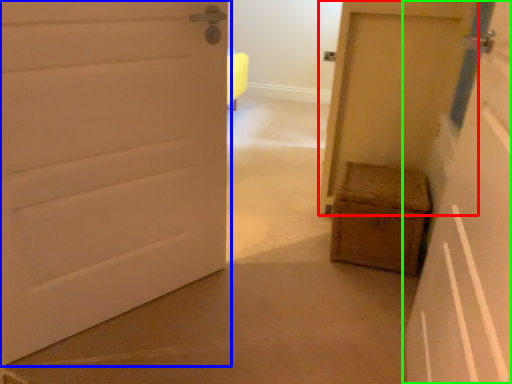
Question: Which is farther away from door (highlighted by a red box)? door (highlighted by a blue box) or door (highlighted by a green box)?

Choices:
 (A) door
 (B) door

Answer: (A)